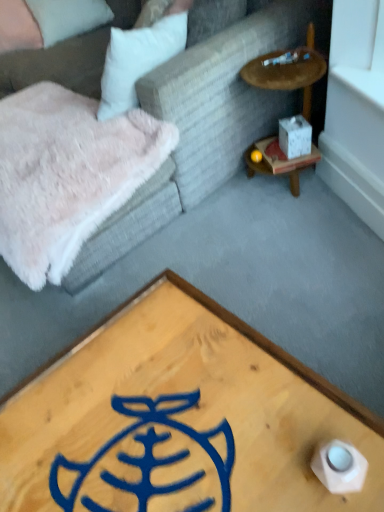
Question: Is beige fabric pillow at upper left, the 1th pillow in the right-to-left sequence, surrounded by white fluffy pillow at upper left, which is the 1th pillow in left-to-right order?

Choices:
 (A) yes
 (B) no

Answer: (B)

Question: Is white fluffy pillow at upper left, acting as the 2th pillow starting from the right, not inside beige fabric pillow at upper left, the 1th pillow in the right-to-left sequence?

Choices:
 (A) yes
 (B) no

Answer: (A)

Question: Can you confirm if white fluffy pillow at upper left, which is the 1th pillow in left-to-right order, is wider than beige fabric pillow at upper left, the 1th pillow in the right-to-left sequence?

Choices:
 (A) yes
 (B) no

Answer: (B)

Question: Is white fluffy pillow at upper left, which is the 1th pillow in left-to-right order, positioned with its back to beige fabric pillow at upper left, which is counted as the second pillow, starting from the left?

Choices:
 (A) no
 (B) yes

Answer: (A)

Question: Considering the relative positions of white fluffy pillow at upper left, acting as the 2th pillow starting from the right, and beige fabric pillow at upper left, which is counted as the second pillow, starting from the left, in the image provided, is white fluffy pillow at upper left, acting as the 2th pillow starting from the right, behind beige fabric pillow at upper left, which is counted as the second pillow, starting from the left,?

Choices:
 (A) yes
 (B) no

Answer: (B)

Question: From a real-world perspective, is wooden at right positioned above or below white matte cube at right?

Choices:
 (A) below
 (B) above

Answer: (B)

Question: In the image, is wooden at right positioned in front of or behind white matte cube at right?

Choices:
 (A) behind
 (B) front

Answer: (B)

Question: Which is correct: wooden at right is inside white matte cube at right, or outside of it?

Choices:
 (A) inside
 (B) outside

Answer: (B)

Question: In terms of size, does wooden at right appear bigger or smaller than white matte cube at right?

Choices:
 (A) small
 (B) big

Answer: (B)

Question: Visually, is white fluffy pillow at upper left, acting as the 2th pillow starting from the right, positioned to the left or to the right of velvet fabric couch at upper left?

Choices:
 (A) right
 (B) left

Answer: (B)

Question: Is white fluffy pillow at upper left, which is the 1th pillow in left-to-right order, wider or thinner than velvet fabric couch at upper left?

Choices:
 (A) wide
 (B) thin

Answer: (B)

Question: Based on their sizes in the image, would you say white fluffy pillow at upper left, which is the 1th pillow in left-to-right order, is bigger or smaller than velvet fabric couch at upper left?

Choices:
 (A) small
 (B) big

Answer: (A)

Question: From their relative heights in the image, would you say white fluffy pillow at upper left, which is the 1th pillow in left-to-right order, is taller or shorter than velvet fabric couch at upper left?

Choices:
 (A) short
 (B) tall

Answer: (A)

Question: Is wooden coffee table at center bigger or smaller than white matte cube at right?

Choices:
 (A) small
 (B) big

Answer: (B)

Question: Would you say wooden coffee table at center is inside or outside white matte cube at right?

Choices:
 (A) outside
 (B) inside

Answer: (A)